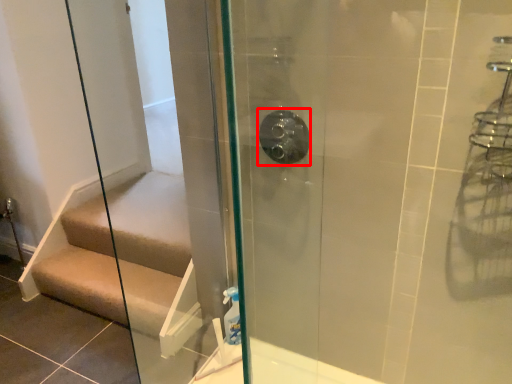
Question: From the image's perspective, what is the correct spatial relationship of shower (annotated by the red box) in relation to stairs?

Choices:
 (A) above
 (B) below

Answer: (A)